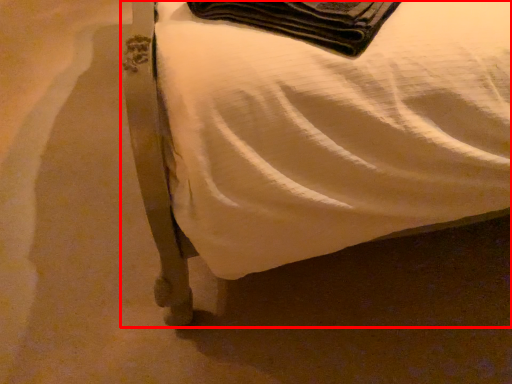
Question: From the image, what is the correct spatial relationship of furniture (annotated by the red box) in relation to blanket?

Choices:
 (A) right
 (B) left

Answer: (A)